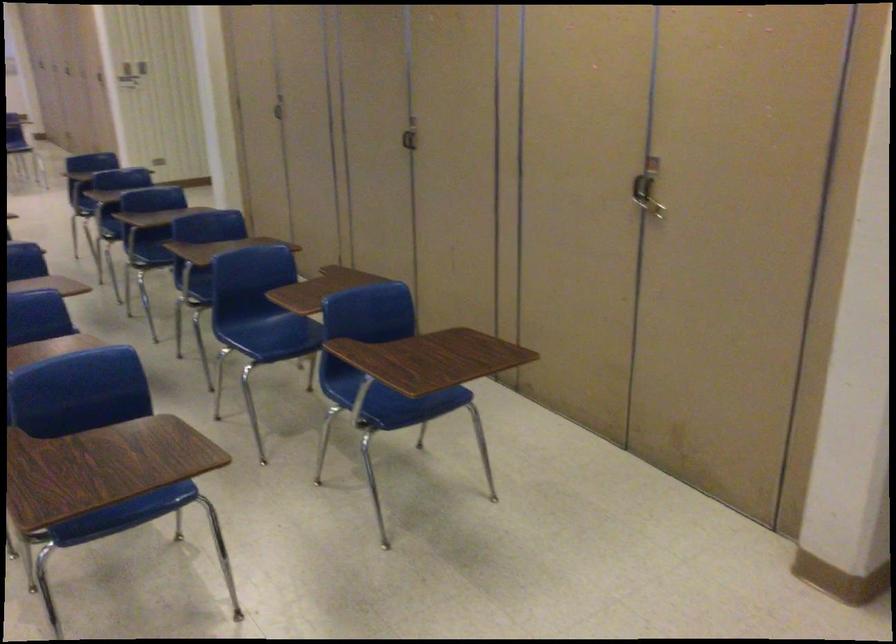
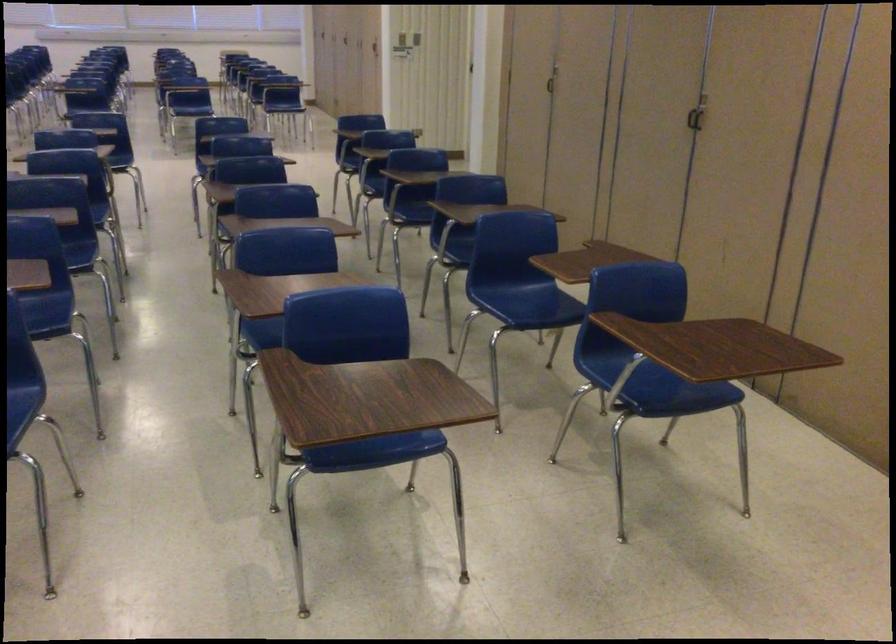
Question: The camera is either moving clockwise (left) or counter-clockwise (right) around the object. The first image is from the beginning of the video and the second image is from the end. Is the camera moving left or right when shooting the video?

Choices:
 (A) Left
 (B) Right

Answer: (B)